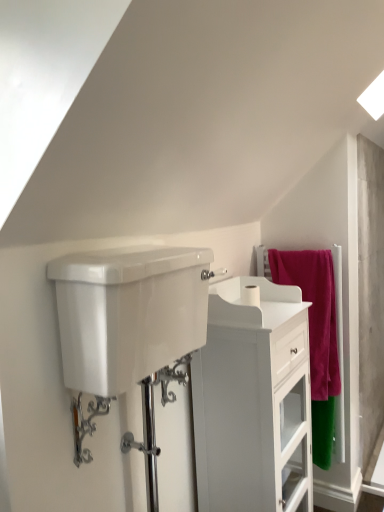
Question: Does point (97, 412) appear closer or farther from the camera than point (152, 402)?

Choices:
 (A) farther
 (B) closer

Answer: (B)

Question: In terms of size, does chrome metallic faucet at lower left appear bigger or smaller than polished chrome shower door at center?

Choices:
 (A) big
 (B) small

Answer: (B)

Question: Which is farther from the chrome metallic faucet at lower left?

Choices:
 (A) white glossy tank at center
 (B) white matte toilet paper at center
 (C) white glossy cabinet at center
 (D) pink fabric towel at right
 (E) polished chrome shower door at center

Answer: (D)

Question: Estimate the real-world distances between objects in this image. Which object is closer to the pink fabric towel at right?

Choices:
 (A) white glossy tank at center
 (B) chrome metallic faucet at lower left
 (C) polished chrome shower door at center
 (D) white matte toilet paper at center
 (E) white glossy cabinet at center

Answer: (E)